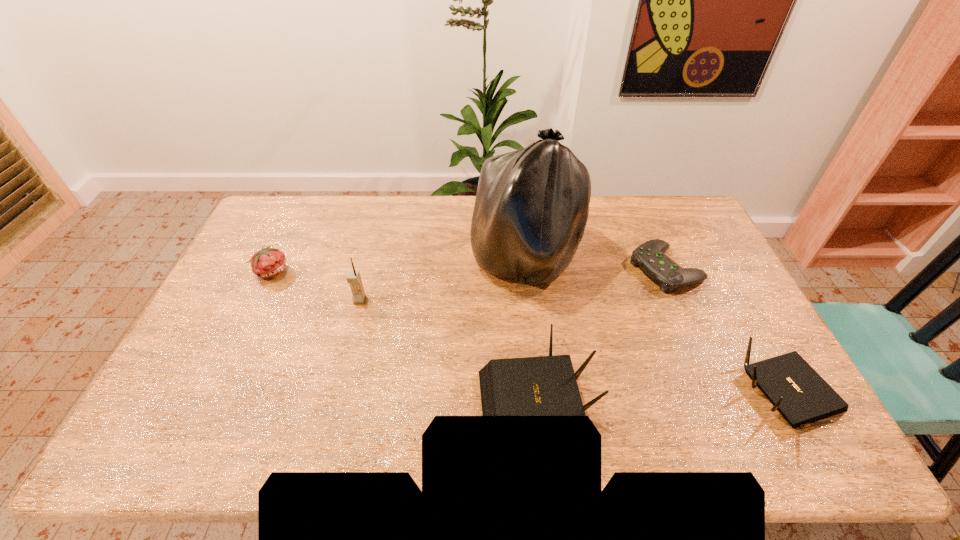
This screenshot has width=960, height=540. In order to click on free spot located 0.280m on the right of the left router in this screenshot , I will do `click(707, 403)`.

Locate an element on the screen. The image size is (960, 540). vacant space located 0.340m on the left of the shorter router is located at coordinates 606,397.

I want to click on free space located on the left of the control, so click(586, 268).

This screenshot has width=960, height=540. Identify the location of vacant region located 0.380m on the left of the plastic bag. (358, 260).

Where is `free location located on the left of the leftmost object`? The width and height of the screenshot is (960, 540). free location located on the left of the leftmost object is located at coordinates (234, 271).

The width and height of the screenshot is (960, 540). What are the coordinates of `vacant space positioned on the front of the fifth shortest object, where the keypad is located` in the screenshot? It's located at (334, 400).

The height and width of the screenshot is (540, 960). I want to click on object that is at the far edge, so click(x=531, y=209).

What are the coordinates of `object that is at the left edge` in the screenshot? It's located at (268, 262).

Find the location of a particular element. This screenshot has width=960, height=540. router at the right edge is located at coordinates (796, 390).

Find the location of a particular element. The height and width of the screenshot is (540, 960). control present at the right edge is located at coordinates (649, 256).